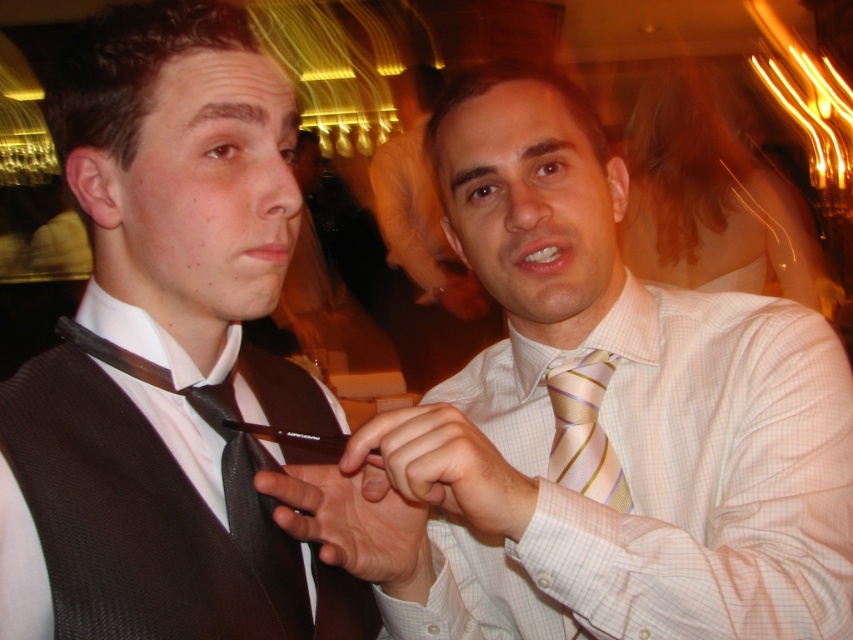
You are standing in front of a social event scene where two people are talking. There are two points marked in the image. The first point is at coordinates point (442, 588) and the second point is at coordinates point (422, 250). Which of these two points is closer to you?

Point (442, 588) is closer to the viewer than point (422, 250).

You are a photographer at the event and want to ensure the matte black tie at center is in focus. You notice that the camera focuses on the point at coordinates point (596, 420). Can you confirm if this point is correctly positioned to capture the matte black tie at center?

Yes, the point (596, 420) is correctly positioned to capture the matte black tie at center as it marks the exact location of the tie.